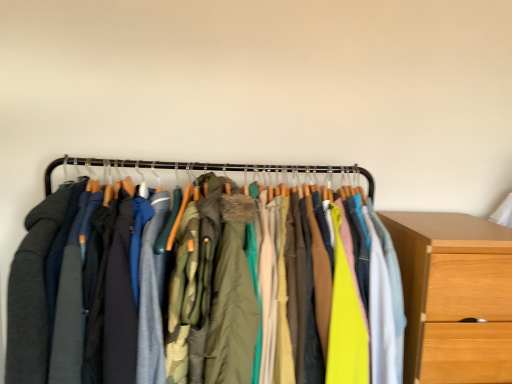
Question: Is wooden chest of drawers at right wider than textured fabric jackets at center?

Choices:
 (A) no
 (B) yes

Answer: (B)

Question: From a real-world perspective, is wooden chest of drawers at right below textured fabric jackets at center?

Choices:
 (A) no
 (B) yes

Answer: (B)

Question: From a real-world perspective, is wooden chest of drawers at right on textured fabric jackets at center?

Choices:
 (A) yes
 (B) no

Answer: (B)

Question: Would you say wooden chest of drawers at right is a long distance from textured fabric jackets at center?

Choices:
 (A) yes
 (B) no

Answer: (B)

Question: Considering the relative positions of wooden chest of drawers at right and textured fabric jackets at center in the image provided, is wooden chest of drawers at right to the right of textured fabric jackets at center from the viewer's perspective?

Choices:
 (A) no
 (B) yes

Answer: (B)

Question: From the image's perspective, relative to wooden chest of drawers at right, is textured fabric jackets at center above or below?

Choices:
 (A) below
 (B) above

Answer: (B)

Question: Considering their positions, is textured fabric jackets at center located in front of or behind wooden chest of drawers at right?

Choices:
 (A) behind
 (B) front

Answer: (B)

Question: Looking at their shapes, would you say textured fabric jackets at center is wider or thinner than wooden chest of drawers at right?

Choices:
 (A) thin
 (B) wide

Answer: (A)

Question: Looking at the image, does textured fabric jackets at center seem bigger or smaller compared to wooden chest of drawers at right?

Choices:
 (A) small
 (B) big

Answer: (B)

Question: Looking at the image, does wooden chest of drawers at right seem bigger or smaller compared to textured fabric jackets at center?

Choices:
 (A) big
 (B) small

Answer: (B)

Question: Considering the positions of wooden chest of drawers at right and textured fabric jackets at center in the image, is wooden chest of drawers at right taller or shorter than textured fabric jackets at center?

Choices:
 (A) short
 (B) tall

Answer: (A)

Question: From a real-world perspective, is wooden chest of drawers at right above or below textured fabric jackets at center?

Choices:
 (A) above
 (B) below

Answer: (B)

Question: From the image's perspective, is wooden chest of drawers at right above or below textured fabric jackets at center?

Choices:
 (A) above
 (B) below

Answer: (B)

Question: Is green textured coat at center situated inside textured fabric jackets at center or outside?

Choices:
 (A) inside
 (B) outside

Answer: (A)

Question: Is point (204, 357) positioned closer to the camera than point (113, 273)?

Choices:
 (A) farther
 (B) closer

Answer: (A)